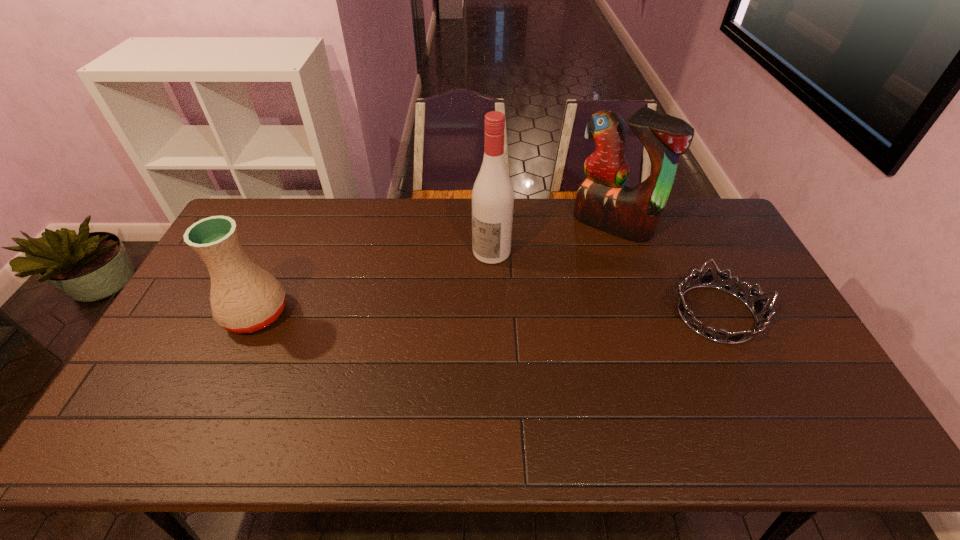
At what (x,y) coordinates should I click in order to perform the action: click on vacant area at the near edge. Please return your answer as a coordinate pair (x, y). The width and height of the screenshot is (960, 540). Looking at the image, I should click on (757, 384).

In the image, there is a desktop. Identify the location of vacant space at the left edge. This screenshot has width=960, height=540. (203, 311).

The image size is (960, 540). In the image, there is a desktop. In order to click on vacant space at the right edge in this screenshot , I will do `click(770, 301)`.

You are a GUI agent. You are given a task and a screenshot of the screen. Output one action in this format:
    pyautogui.click(x=<x>, y=<y>)
    Task: Click on the vacant area at the far left corner
    This screenshot has width=960, height=540.
    Given the screenshot: What is the action you would take?
    pyautogui.click(x=274, y=223)

Where is `free space between the third shortest object and the tiara`? Image resolution: width=960 pixels, height=540 pixels. free space between the third shortest object and the tiara is located at coordinates (664, 269).

Locate an element on the screen. The height and width of the screenshot is (540, 960). free space between the tiara and the parrot is located at coordinates (664, 269).

Locate an element on the screen. This screenshot has height=540, width=960. empty location between the leftmost object and the second object from left to right is located at coordinates (373, 283).

Find the location of `free point between the tiara and the third object from right to left`. free point between the tiara and the third object from right to left is located at coordinates (604, 283).

Locate an element on the screen. Image resolution: width=960 pixels, height=540 pixels. free space between the parrot and the alcohol is located at coordinates (552, 238).

You are a GUI agent. You are given a task and a screenshot of the screen. Output one action in this format:
    pyautogui.click(x=<x>, y=<y>)
    Task: Click on the vacant area between the third tallest object and the alcohol
    The width and height of the screenshot is (960, 540).
    Given the screenshot: What is the action you would take?
    pyautogui.click(x=373, y=283)